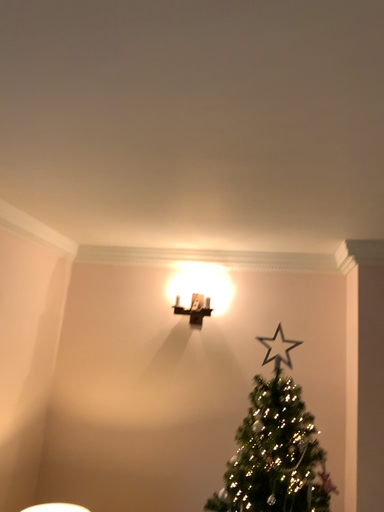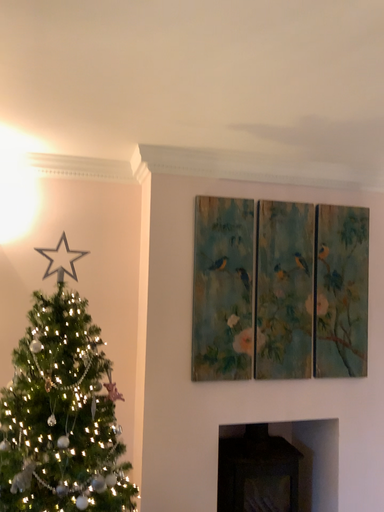
Question: How did the camera likely rotate when shooting the video?

Choices:
 (A) rotated right
 (B) rotated left

Answer: (A)